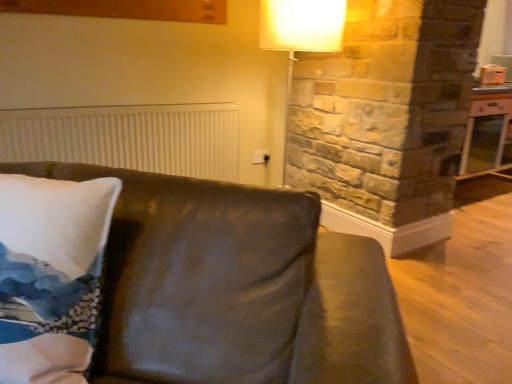
The height and width of the screenshot is (384, 512). What are the coordinates of `wooden table at right` in the screenshot? It's located at (486, 131).

At what (x,y) coordinates should I click in order to perform the action: click on leather couch at center. Please return your answer as a coordinate pair (x, y). The height and width of the screenshot is (384, 512). Looking at the image, I should click on (236, 288).

This screenshot has width=512, height=384. What are the coordinates of `wooden table at right` in the screenshot? It's located at (486, 131).

Considering the sizes of wooden table at right and white ribbed radiator at upper left in the image, is wooden table at right wider or thinner than white ribbed radiator at upper left?

Considering their sizes, wooden table at right looks broader than white ribbed radiator at upper left.

In terms of height, does wooden table at right look taller or shorter compared to white ribbed radiator at upper left?

Considering their sizes, wooden table at right has more height than white ribbed radiator at upper left.

How many degrees apart are the facing directions of wooden table at right and white ribbed radiator at upper left?

wooden table at right and white ribbed radiator at upper left are facing 0.0444 degrees away from each other.

Are wooden table at right and white ribbed radiator at upper left located far from each other?

wooden table at right is positioned a significant distance from white ribbed radiator at upper left.

Is leather couch at center positioned with its back to wooden table at right?

Yes, leather couch at center is positioned with its back facing wooden table at right.

Which object is thinner, leather couch at center or wooden table at right?

wooden table at right.

Considering the relative positions of leather couch at center and wooden table at right in the image provided, is leather couch at center to the left of wooden table at right from the viewer's perspective?

Yes, leather couch at center is to the left of wooden table at right.

Does point (106, 379) come behind point (475, 150)?

No, it is not.

At what (x,y) coordinates should I click in order to perform the action: click on radiator in front of the wooden table at right. Please return your answer as a coordinate pair (x, y). The height and width of the screenshot is (384, 512). Looking at the image, I should click on (128, 138).

Is wooden table at right located within white ribbed radiator at upper left?

That's incorrect, wooden table at right is not inside white ribbed radiator at upper left.

Which of these two, white ribbed radiator at upper left or wooden table at right, stands shorter?

Standing shorter between the two is white ribbed radiator at upper left.

Is leather couch at center smaller than white ribbed radiator at upper left?

Actually, leather couch at center might be larger than white ribbed radiator at upper left.

Could you tell me if leather couch at center is turned towards white ribbed radiator at upper left?

No, leather couch at center is not turned towards white ribbed radiator at upper left.

Which point is more distant from viewer, (x=309, y=288) or (x=230, y=116)?

The point (x=230, y=116) is farther from the camera.

Is wooden table at right at the right side of leather couch at center?

Yes.

From the image's perspective, does wooden table at right appear higher than leather couch at center?

Yes.

Looking at the image, does wooden table at right seem bigger or smaller compared to leather couch at center?

Considering their sizes, wooden table at right takes up less space than leather couch at center.

Is white ribbed radiator at upper left thinner than leather couch at center?

Yes, white ribbed radiator at upper left is thinner than leather couch at center.

Does white ribbed radiator at upper left touch leather couch at center?

No, white ribbed radiator at upper left is not with leather couch at center.

In the scene shown: Between white ribbed radiator at upper left and leather couch at center, which one appears on the left side from the viewer's perspective?

white ribbed radiator at upper left.

What are the coordinates of `radiator above the leather couch at center (from a real-world perspective)` in the screenshot? It's located at (128, 138).

The image size is (512, 384). In order to click on radiator that is on the left side of wooden table at right in this screenshot , I will do `click(128, 138)`.

The image size is (512, 384). I want to click on studio couch below the wooden table at right (from the image's perspective), so click(236, 288).

Which object lies further to the anchor point wooden table at right, leather couch at center or white ribbed radiator at upper left?

The object further to wooden table at right is leather couch at center.

Which object lies nearer to the anchor point white ribbed radiator at upper left, wooden table at right or leather couch at center?

leather couch at center.

When comparing their distances from leather couch at center, does wooden table at right or white ribbed radiator at upper left seem further?

wooden table at right is further to leather couch at center.

Considering their positions, is white ribbed radiator at upper left positioned closer to leather couch at center than wooden table at right?

white ribbed radiator at upper left is positioned closer to the anchor leather couch at center.

Considering their positions, is leather couch at center positioned further to white ribbed radiator at upper left than wooden table at right?

wooden table at right is further to white ribbed radiator at upper left.

Which object lies further to the anchor point wooden table at right, white ribbed radiator at upper left or leather couch at center?

leather couch at center lies further to wooden table at right than the other object.

The width and height of the screenshot is (512, 384). I want to click on radiator located between leather couch at center and wooden table at right in the depth direction, so click(128, 138).